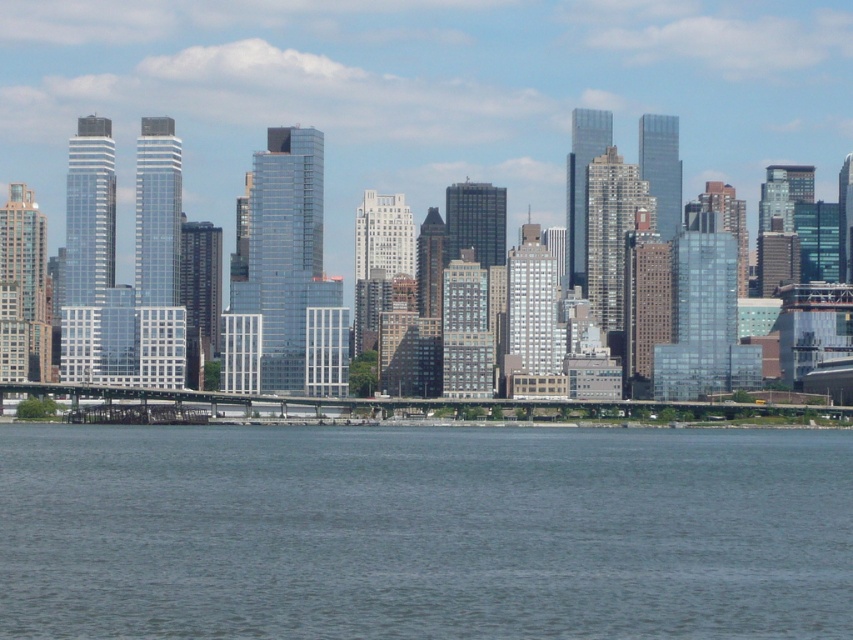
Question: Can you confirm if blue water at lower center is smaller than glassy skyscrapers at center?

Choices:
 (A) yes
 (B) no

Answer: (A)

Question: Does blue water at lower center lie behind glassy skyscrapers at center?

Choices:
 (A) yes
 (B) no

Answer: (A)

Question: Is blue water at lower center closer to the viewer compared to glassy skyscrapers at center?

Choices:
 (A) yes
 (B) no

Answer: (B)

Question: Which of the following is the farthest from the observer?

Choices:
 (A) (440, 552)
 (B) (827, 310)

Answer: (B)